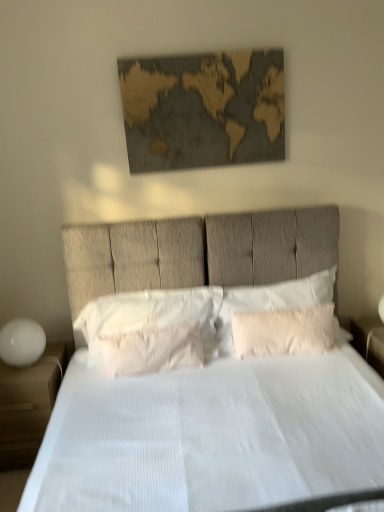
Question: Is white matte nightstand at lower left, arranged as the second nightstand when viewed from the right, to the left of white textured pillow at center, arranged as the third pillow when viewed from the left, from the viewer's perspective?

Choices:
 (A) yes
 (B) no

Answer: (A)

Question: Can you see white matte nightstand at lower left, which is counted as the first nightstand, starting from the left, touching white textured pillow at center, which is counted as the 1th pillow, starting from the right?

Choices:
 (A) no
 (B) yes

Answer: (A)

Question: Can you confirm if white matte nightstand at lower left, arranged as the second nightstand when viewed from the right, is smaller than white textured pillow at center, which is counted as the 1th pillow, starting from the right?

Choices:
 (A) yes
 (B) no

Answer: (B)

Question: Is white matte nightstand at lower left, which is counted as the first nightstand, starting from the left, positioned with its back to white textured pillow at center, arranged as the third pillow when viewed from the left?

Choices:
 (A) no
 (B) yes

Answer: (A)

Question: Does white matte nightstand at lower left, which is counted as the first nightstand, starting from the left, have a greater height compared to white textured pillow at center, which is counted as the 1th pillow, starting from the right?

Choices:
 (A) yes
 (B) no

Answer: (A)

Question: From the image's perspective, relative to white textured pillow at center, the 2th pillow from the left, is gold textured map at upper center above or below?

Choices:
 (A) below
 (B) above

Answer: (B)

Question: Is point (177, 93) positioned closer to the camera than point (130, 350)?

Choices:
 (A) closer
 (B) farther

Answer: (B)

Question: Is gold textured map at upper center wider or thinner than white textured pillow at center, the 2th pillow positioned from the right?

Choices:
 (A) wide
 (B) thin

Answer: (B)

Question: Looking at the image, does gold textured map at upper center seem bigger or smaller compared to white textured pillow at center, the 2th pillow from the left?

Choices:
 (A) small
 (B) big

Answer: (A)

Question: From the image's perspective, is white textured pillow at center, which appears as the 1th pillow when viewed from the left, located above or below white textured pillow at center, the 2th pillow positioned from the right?

Choices:
 (A) above
 (B) below

Answer: (A)

Question: Based on their sizes in the image, would you say white textured pillow at center, which appears as the 1th pillow when viewed from the left, is bigger or smaller than white textured pillow at center, the 2th pillow positioned from the right?

Choices:
 (A) big
 (B) small

Answer: (A)

Question: Is point (200, 320) positioned closer to the camera than point (170, 351)?

Choices:
 (A) closer
 (B) farther

Answer: (B)

Question: Visually, is white textured pillow at center, which appears as the 1th pillow when viewed from the left, positioned to the left or to the right of white textured pillow at center, the 2th pillow from the left?

Choices:
 (A) right
 (B) left

Answer: (B)

Question: From the image's perspective, is white textured pillow at center, the third pillow from the right, located above or below gold textured map at upper center?

Choices:
 (A) above
 (B) below

Answer: (B)

Question: In the image, is white textured pillow at center, the third pillow from the right, positioned in front of or behind gold textured map at upper center?

Choices:
 (A) front
 (B) behind

Answer: (A)